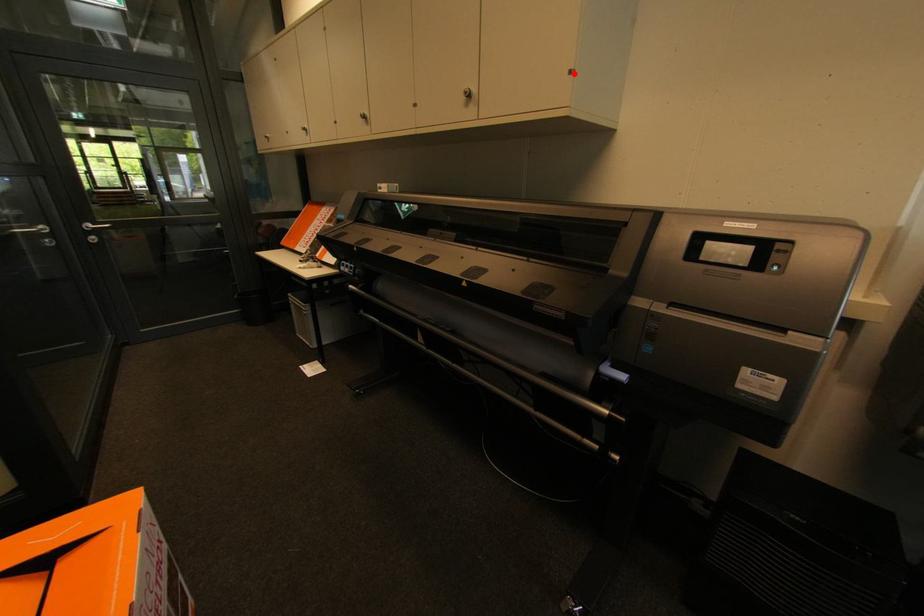
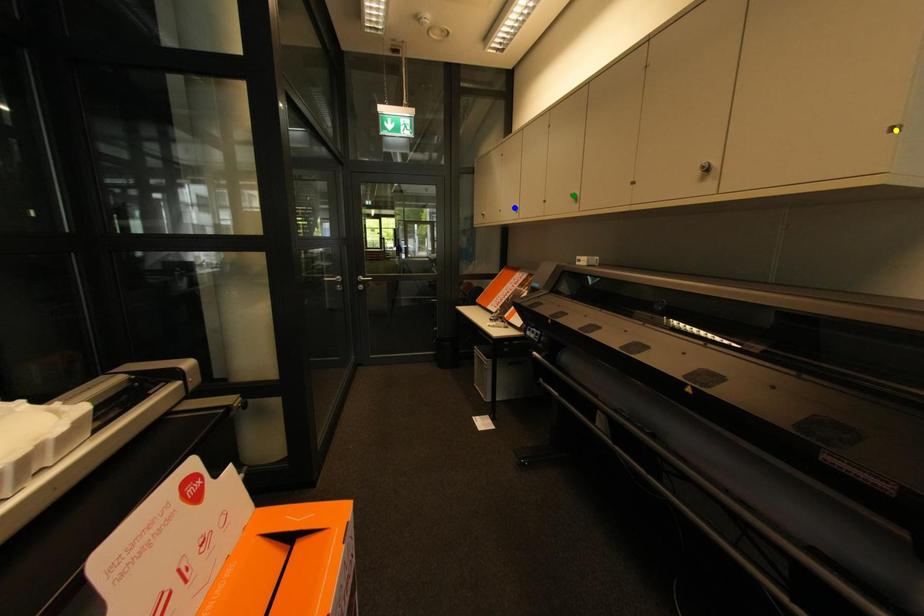
Question: I am providing you with two images of the same scene from different viewpoints. A red point is marked on the first image. You are given multiple points on the second image. Which spot in image 2 lines up with the point in image 1?

Choices:
 (A) green point
 (B) yellow point
 (C) blue point

Answer: (B)